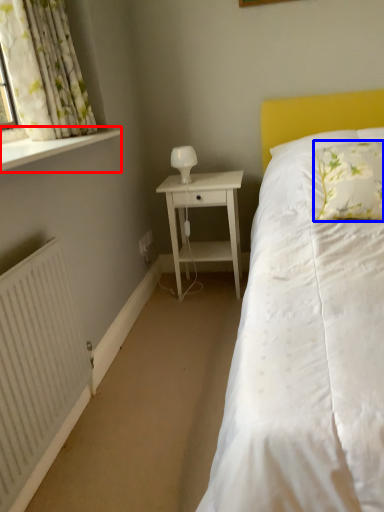
Question: Which point is closer to the camera, window sill (highlighted by a red box) or pillow (highlighted by a blue box)?

Choices:
 (A) window sill
 (B) pillow

Answer: (A)